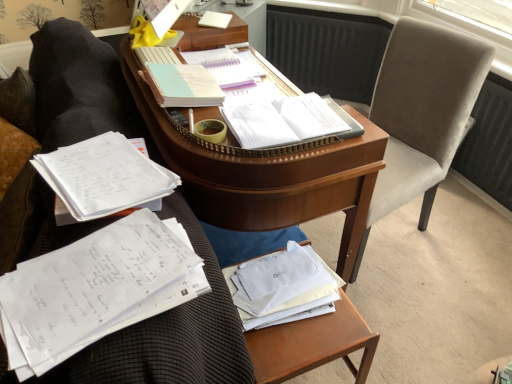
Question: From a real-world perspective, relative to wooden at lower right, is wooden desk at center vertically above or below?

Choices:
 (A) below
 (B) above

Answer: (B)

Question: Based on their positions, is wooden desk at center located to the left or right of wooden at lower right?

Choices:
 (A) right
 (B) left

Answer: (B)

Question: Which object is positioned farthest from the white paper at center, arranged as the 3th book when viewed from the back?

Choices:
 (A) light blue spiral notebook at center, the third book positioned from the front
 (B) white paper at left, which is the first book from front to back
 (C) wooden at lower right
 (D) light blue paper at center, which ranks as the first book in back-to-front order
 (E) velvet gray swivel chair at right

Answer: (E)

Question: Which object is positioned closest to the white paper at center, which is counted as the second book, starting from the front?

Choices:
 (A) velvet gray swivel chair at right
 (B) wooden desk at center
 (C) light blue paper at center, the fourth book from the front
 (D) light blue spiral notebook at center, the third book positioned from the front
 (E) wooden at lower right

Answer: (D)